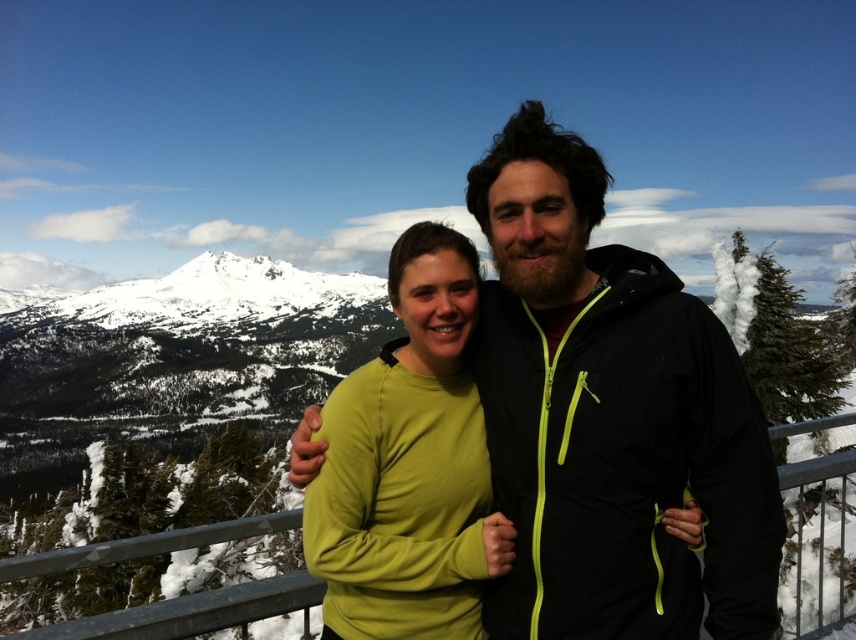
Question: Which object is closer to the camera taking this photo?

Choices:
 (A) matte black jacket at center
 (B) green matte sweater at center

Answer: (A)

Question: Is matte black jacket at center to the left of green matte sweater at center from the viewer's perspective?

Choices:
 (A) no
 (B) yes

Answer: (A)

Question: In this image, where is matte black jacket at center located relative to green matte sweater at center?

Choices:
 (A) right
 (B) left

Answer: (A)

Question: Considering the relative positions of matte black jacket at center and green matte sweater at center in the image provided, where is matte black jacket at center located with respect to green matte sweater at center?

Choices:
 (A) below
 (B) above

Answer: (B)